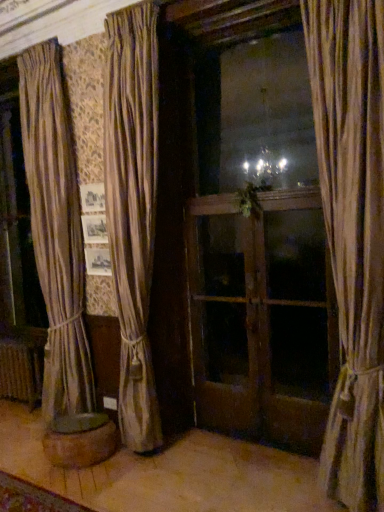
At what (x,y) coordinates should I click in order to perform the action: click on free space to the right of silky beige curtain at center, which appears as the 2th curtain when viewed from the right. Please return your answer as a coordinate pair (x, y). The height and width of the screenshot is (512, 384). Looking at the image, I should click on (206, 446).